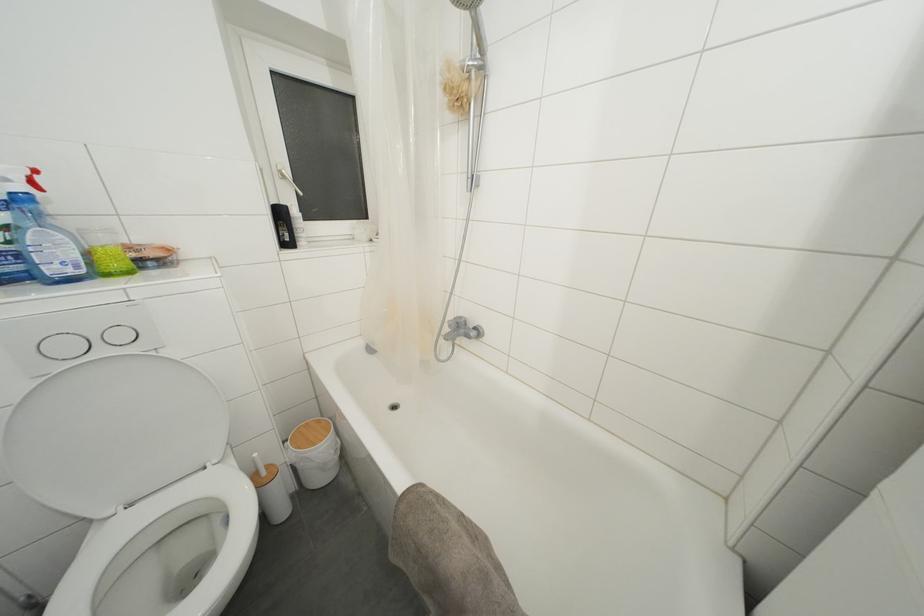
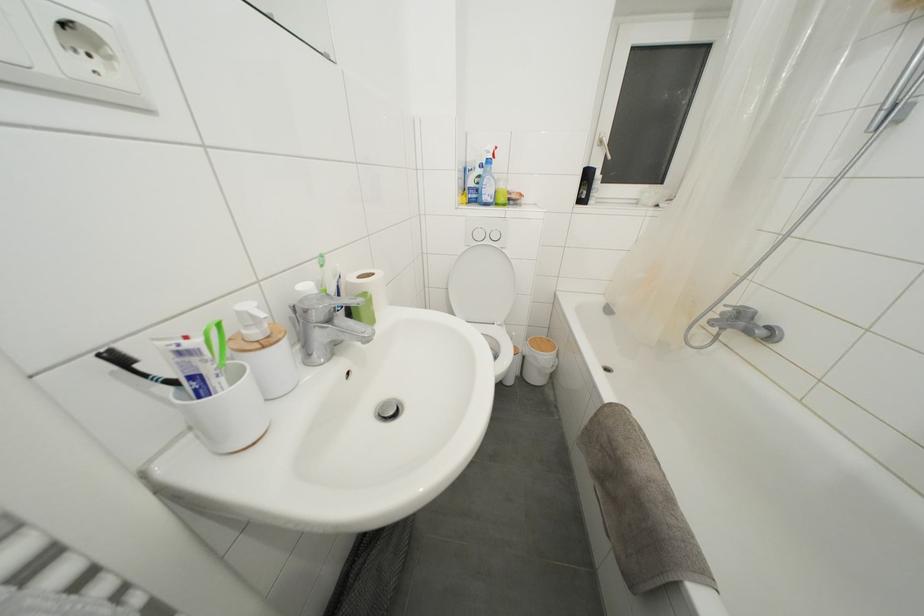
In the second image, find the point that corresponds to the point at 454,331 in the first image.

(726, 318)